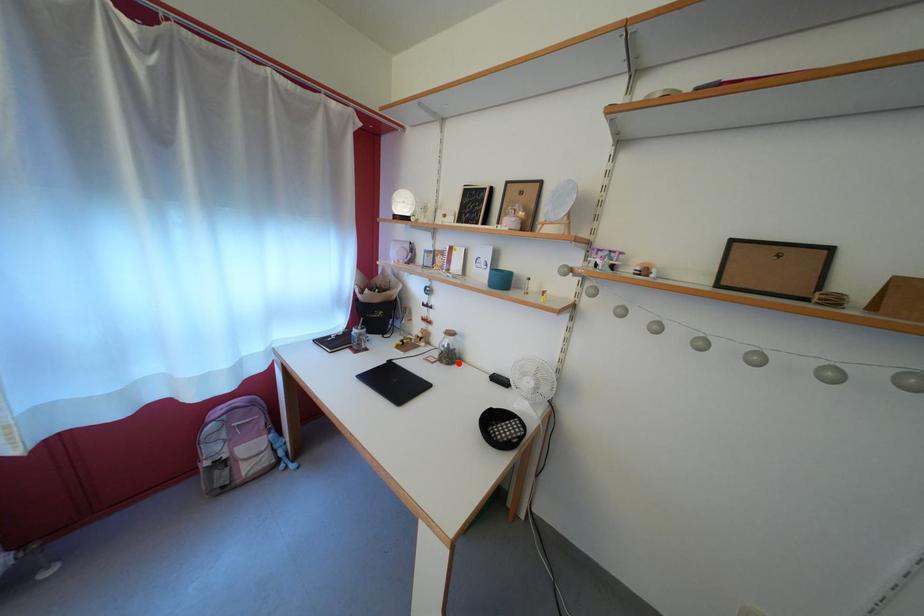
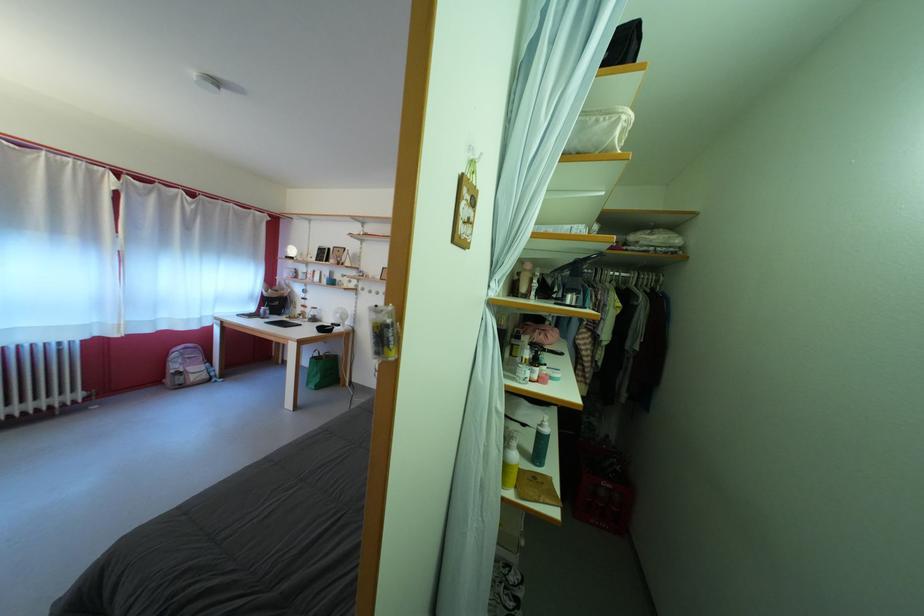
Locate, in the second image, the point that corresponds to the highlighted location in the first image.

(322, 325)